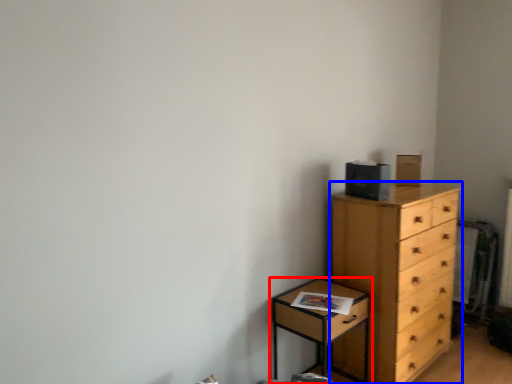
Question: Which object is further to the camera taking this photo, nightstand (highlighted by a red box) or chest of drawers (highlighted by a blue box)?

Choices:
 (A) nightstand
 (B) chest of drawers

Answer: (B)